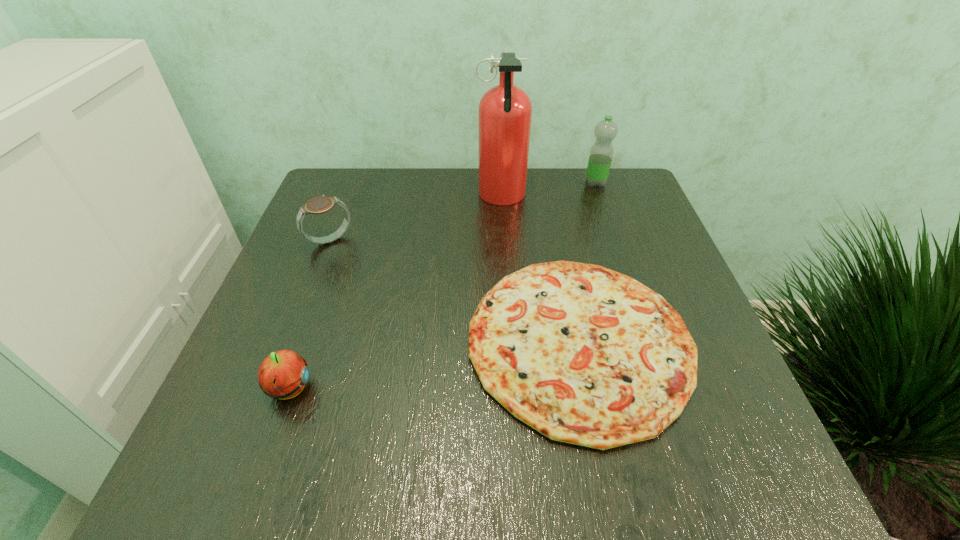
Identify the location of fire extinguisher. The image size is (960, 540). (505, 111).

This screenshot has height=540, width=960. I want to click on the fourth shortest object, so click(601, 153).

Where is `the third farthest object`? the third farthest object is located at coordinates (318, 205).

What are the coordinates of `watch` in the screenshot? It's located at (318, 205).

At what (x,y) coordinates should I click in order to perform the action: click on apple. Please return your answer as a coordinate pair (x, y). The width and height of the screenshot is (960, 540). Looking at the image, I should click on click(x=283, y=374).

Where is `pizza`? pizza is located at coordinates (585, 355).

The image size is (960, 540). Find the location of `free space located on the front of the fire extinguisher`. free space located on the front of the fire extinguisher is located at coordinates (506, 278).

The height and width of the screenshot is (540, 960). I want to click on free space located 0.240m on the front of the second tallest object, so click(x=617, y=247).

Where is `vacant position located on the front of the third farthest object`? The height and width of the screenshot is (540, 960). vacant position located on the front of the third farthest object is located at coordinates (270, 399).

Where is `vacant area situated 0.250m on the back of the second shortest object`? This screenshot has height=540, width=960. vacant area situated 0.250m on the back of the second shortest object is located at coordinates (331, 270).